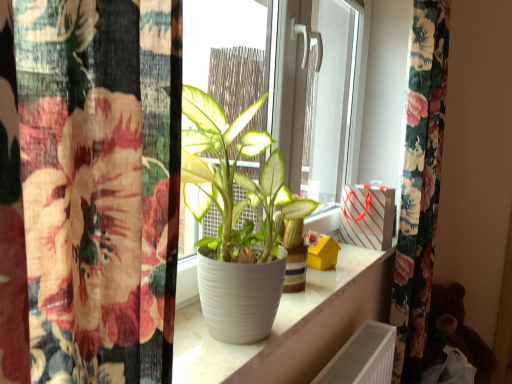
Question: Is white matte pot at center bigger or smaller than white striped paper bag at upper right?

Choices:
 (A) small
 (B) big

Answer: (B)

Question: From the image's perspective, relative to white striped paper bag at upper right, is white matte pot at center above or below?

Choices:
 (A) below
 (B) above

Answer: (B)

Question: Which object is positioned closest to the white matte pot at center?

Choices:
 (A) white striped paper bag at upper right
 (B) brown plush bear at lower right
 (C) white glossy pot at center

Answer: (C)

Question: Which of these objects is positioned closest to the white matte pot at center?

Choices:
 (A) brown plush bear at lower right
 (B) white striped paper bag at upper right
 (C) white glossy pot at center

Answer: (C)